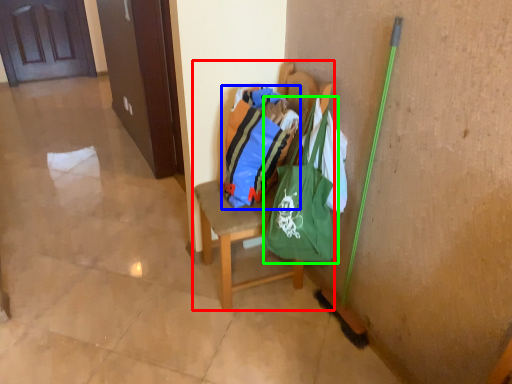
Question: Which object is positioned farthest from chair (highlighted by a red box)? Select from shopping bag (highlighted by a blue box) and shoulder bag (highlighted by a green box).

Choices:
 (A) shopping bag
 (B) shoulder bag

Answer: (B)